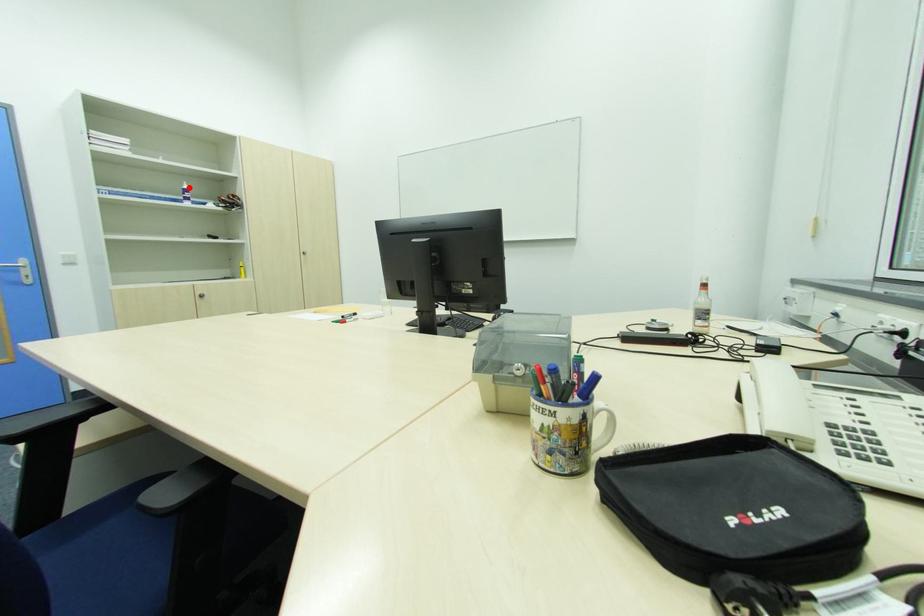
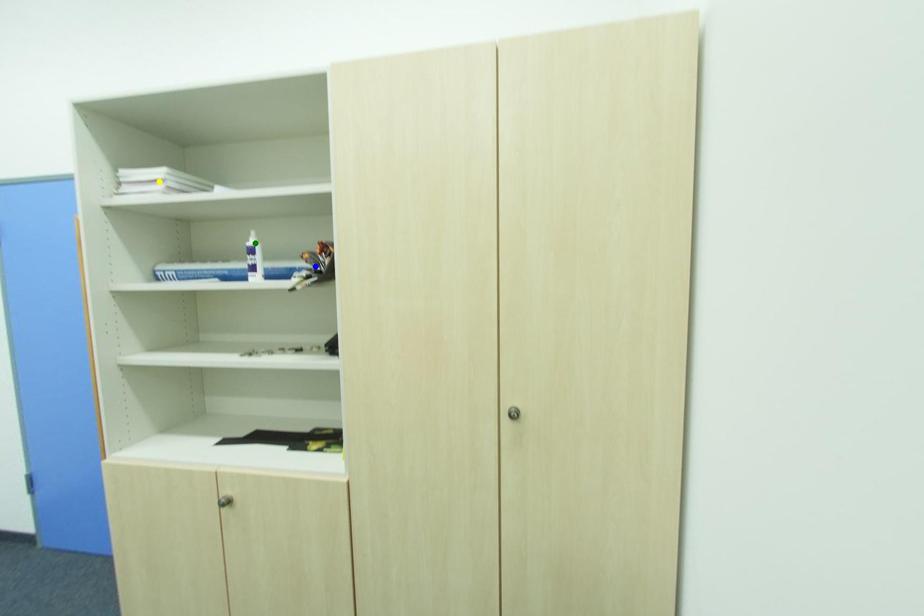
Question: I am providing you with two images of the same scene from different viewpoints. A red point is marked on the first image. You are given multiple points on the second image. Can you choose the point in image 2 that corresponds to the point in image 1?

Choices:
 (A) green point
 (B) yellow point
 (C) blue point

Answer: (A)